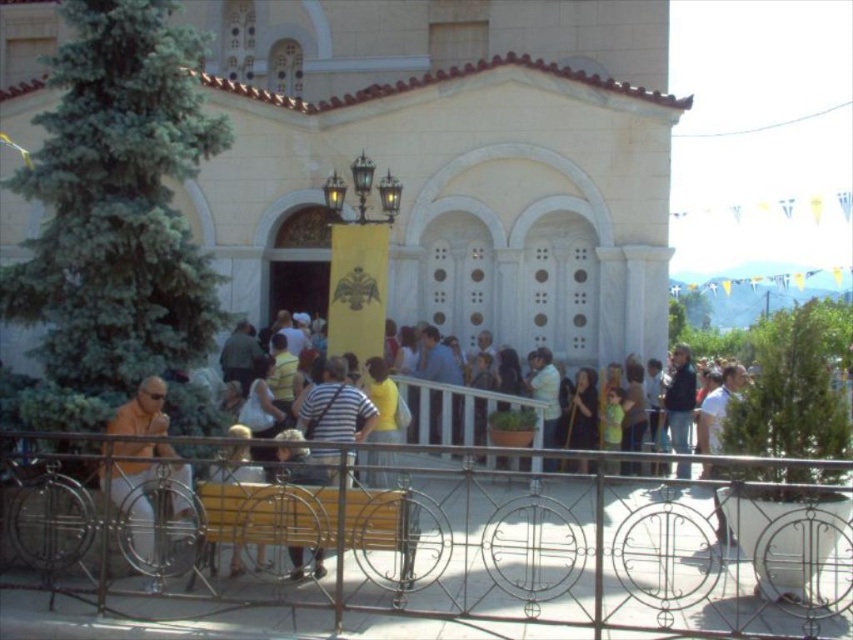
What do you see at coordinates (447, 541) in the screenshot? The height and width of the screenshot is (640, 853). I see `metallic wrought iron at center` at bounding box center [447, 541].

Is metallic wrought iron at center shorter than wooden bench at lower center?

No.

What do you see at coordinates (447, 541) in the screenshot?
I see `metallic wrought iron at center` at bounding box center [447, 541].

The width and height of the screenshot is (853, 640). What are the coordinates of `metallic wrought iron at center` in the screenshot? It's located at (447, 541).

Between white cotton shirt at center and wooden bench at lower center, which one has more height?

white cotton shirt at center is taller.

Find the location of a particular element. This screenshot has width=853, height=640. white cotton shirt at center is located at coordinates (717, 406).

Between point (715, 444) and point (265, 563), which one is positioned behind?

The point (715, 444) is more distant.

At what (x,y) coordinates should I click in order to perform the action: click on white cotton shirt at center. Please return your answer as a coordinate pair (x, y). Image resolution: width=853 pixels, height=640 pixels. Looking at the image, I should click on (717, 406).

Is orange fabric shirt at left positioned behind wooden bench at lower center?

That is True.

Consider the image. Can you confirm if orange fabric shirt at left is positioned below wooden bench at lower center?

Incorrect, orange fabric shirt at left is not positioned below wooden bench at lower center.

Who is more forward, (131, 531) or (223, 460)?

Point (223, 460) is more forward.

The width and height of the screenshot is (853, 640). I want to click on orange fabric shirt at left, so click(148, 499).